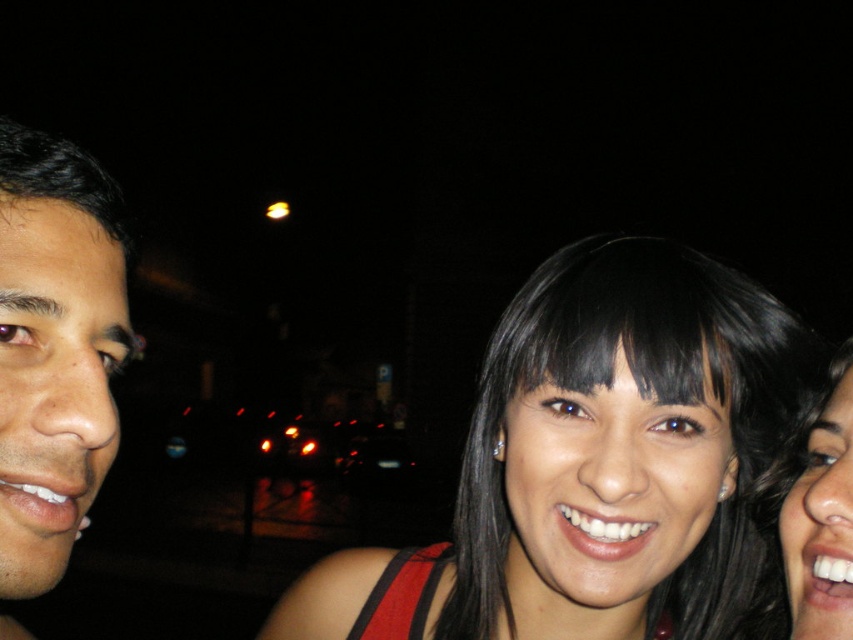
Question: Can you confirm if smooth skin face at left is positioned below black glossy hair at right?

Choices:
 (A) no
 (B) yes

Answer: (A)

Question: Can you confirm if smooth skin face at left is thinner than black glossy hair at right?

Choices:
 (A) yes
 (B) no

Answer: (B)

Question: Where is smooth skin face at left located in relation to black glossy hair at right in the image?

Choices:
 (A) above
 (B) below

Answer: (A)

Question: Which object is farther from the camera taking this photo?

Choices:
 (A) black glossy hair at right
 (B) smooth skin face at left

Answer: (A)